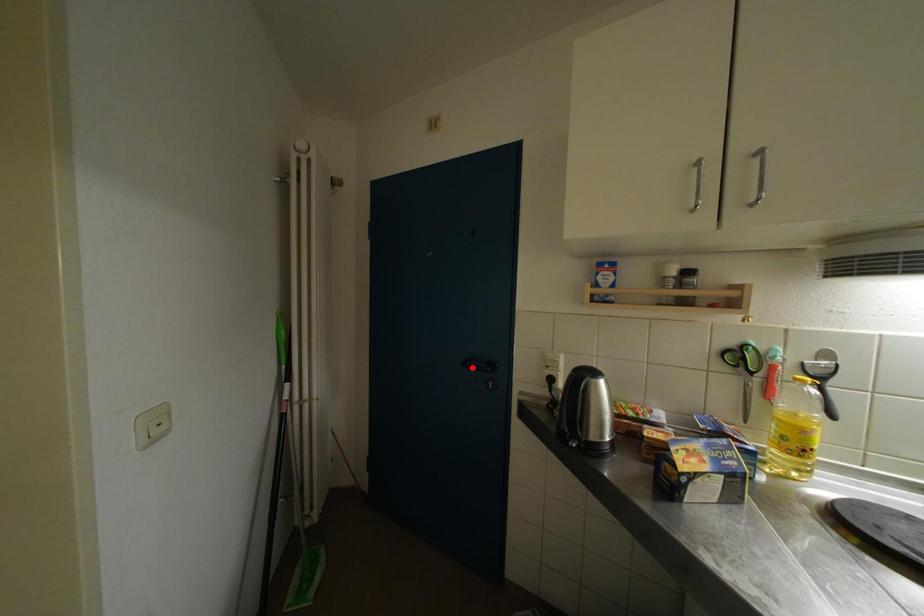
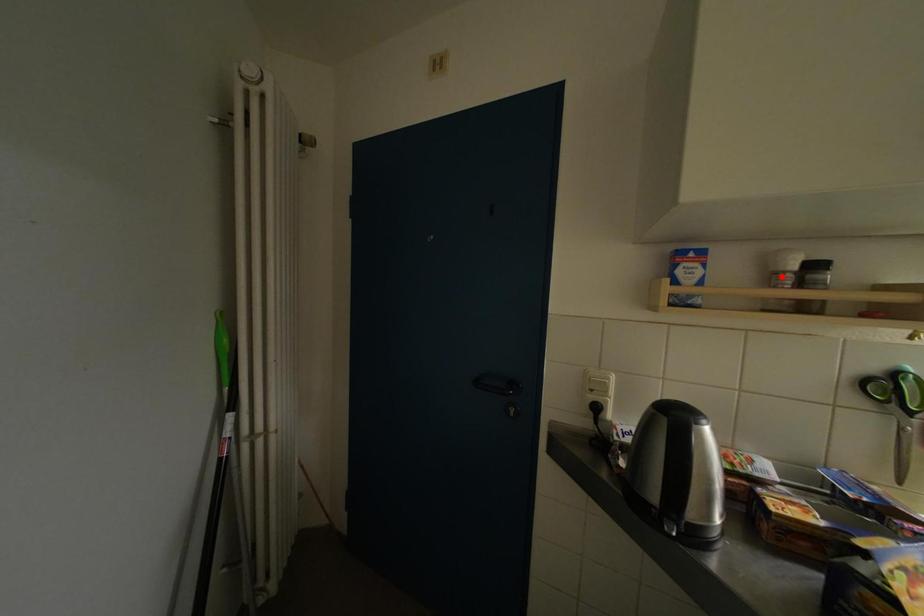
I am providing you with two images of the same scene from different viewpoints. A red point is marked on the first image and another point is marked on the second image. Do the highlighted points in image1 and image2 indicate the same real-world spot?

No